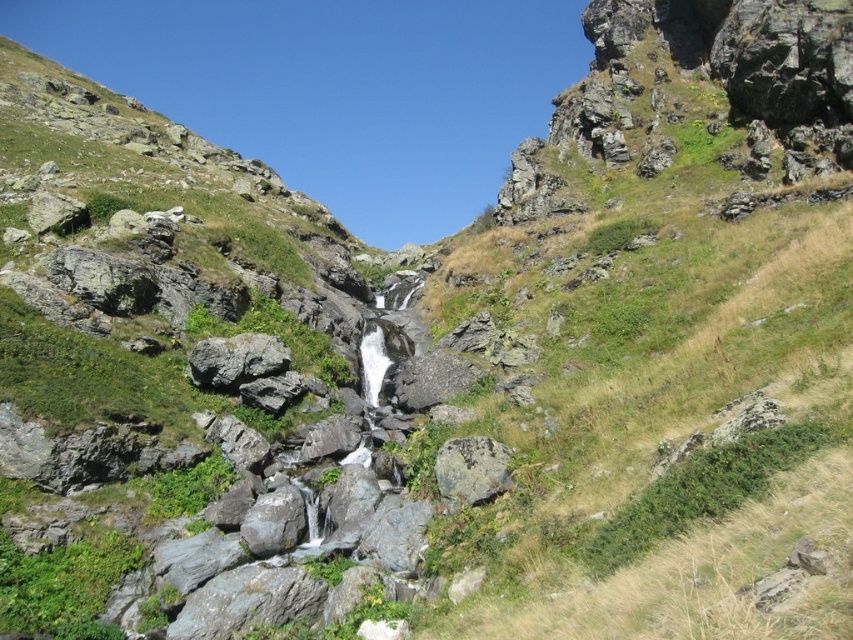
You are a hiker navigating the rocky terrain and see the gray rough rock at center and the rusty metallic rock at center. Which one is positioned to the left?

The gray rough rock at center is positioned to the left of the rusty metallic rock at center.

You are a hiker planning to cross the rocky terrain between the gray rough rock at center and the rusty metallic rock at center. Which rock should you avoid stepping on to prevent slipping?

You should avoid stepping on the rusty metallic rock at center because it is below the gray rough rock at center and might be more slippery due to its metallic surface.

You are a hiker navigating the rocky terrain and need to place a heavy backpack between the gray rough rock at center and the rusty metallic rock at center. Which rock should you choose as the base to ensure the backpack stays stable?

The gray rough rock at center has a larger size compared to the rusty metallic rock at center, so placing the backpack on the gray rough rock at center would provide a more stable base due to its larger surface area.